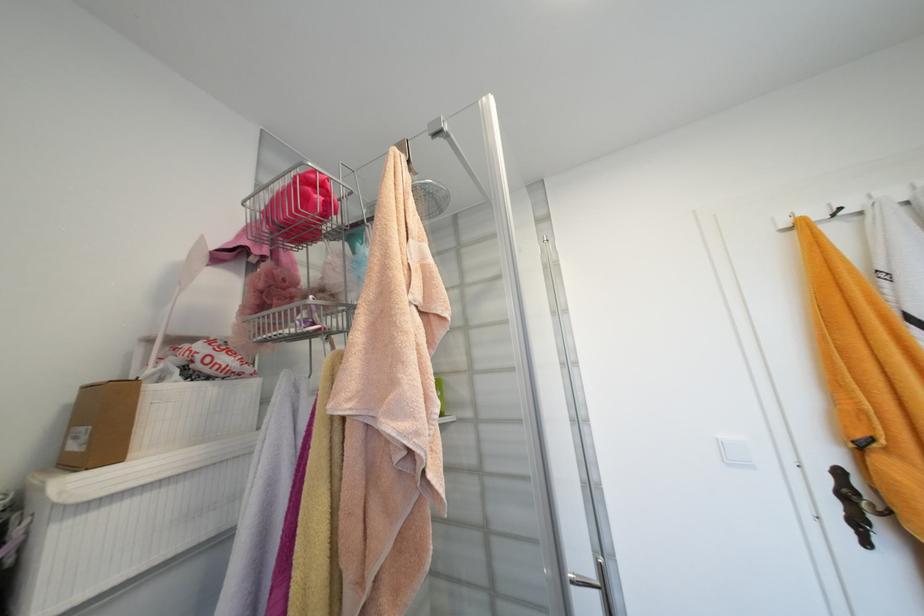
Where is `small cardboard box`? The width and height of the screenshot is (924, 616). small cardboard box is located at coordinates (153, 418).